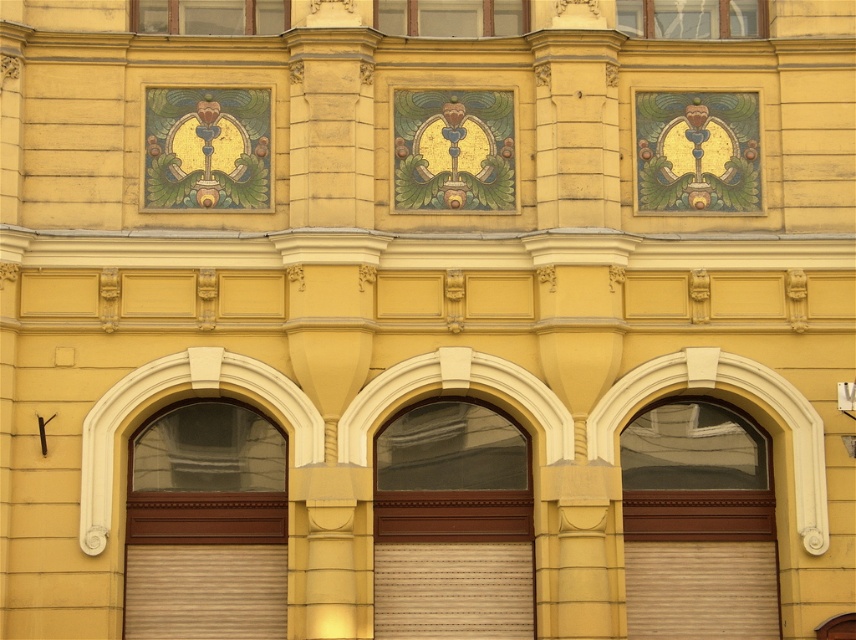
You are standing in front of the building and notice a point at coordinates (697, 524). What object is located at that point?

Answer: The brown metallic roller door at lower right is located at point (697, 524).

You are a delivery person trying to deliver a package to the building. The package is too large to fit through the transparent glass window at upper center. Can you use the brown metallic roller door at lower right instead?

The brown metallic roller door at lower right has a larger size compared to the transparent glass window at upper center, so yes, the package can be delivered through the brown metallic roller door at lower right.